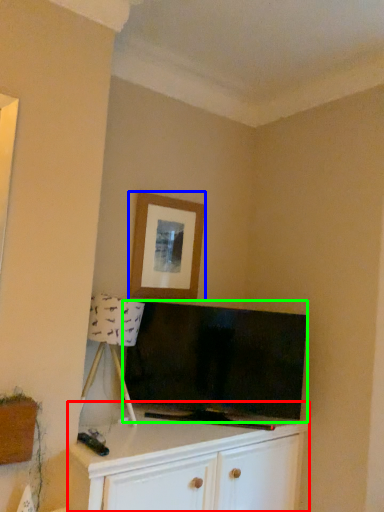
Question: Which object is the closest to the cabinetry (highlighted by a red box)? Choose among these: picture frame (highlighted by a blue box) or television (highlighted by a green box).

Choices:
 (A) picture frame
 (B) television

Answer: (B)